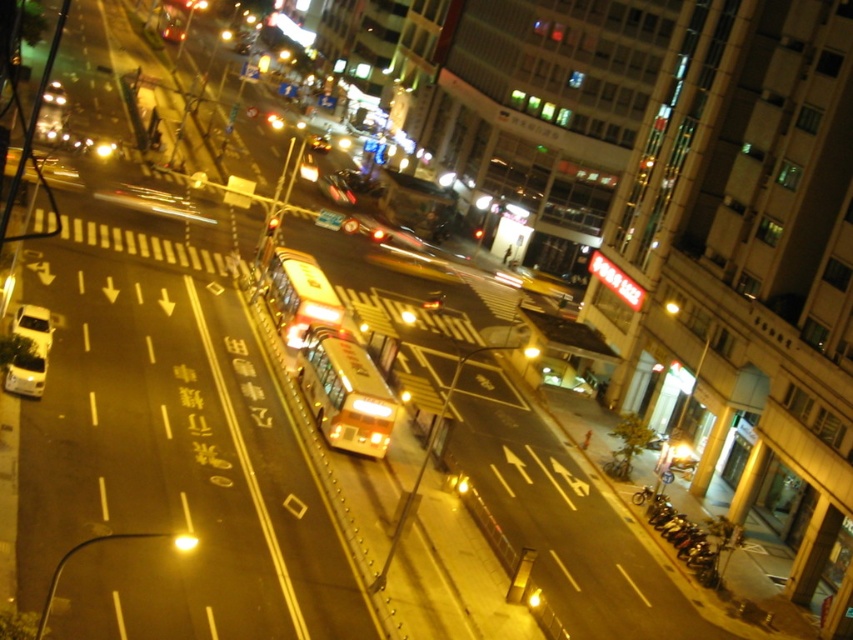
Question: Observing the image, what is the correct spatial positioning of yellow metallic bus at center in reference to metallic gold bus at center?

Choices:
 (A) right
 (B) left

Answer: (B)

Question: Can you confirm if yellow metallic bus at center is positioned to the right of metallic orange bus at center?

Choices:
 (A) no
 (B) yes

Answer: (B)

Question: Estimate the real-world distances between objects in this image. Which object is farther from the yellow metallic bus at center?

Choices:
 (A) metallic orange bus at center
 (B) metallic gold bus at center

Answer: (B)

Question: Does yellow metallic bus at center lie behind metallic orange bus at center?

Choices:
 (A) no
 (B) yes

Answer: (A)

Question: Which point is farther to the camera?

Choices:
 (A) (393, 198)
 (B) (300, 280)

Answer: (A)

Question: Which is farther from the yellow metallic bus at center?

Choices:
 (A) metallic gold bus at center
 (B) metallic orange bus at center

Answer: (A)